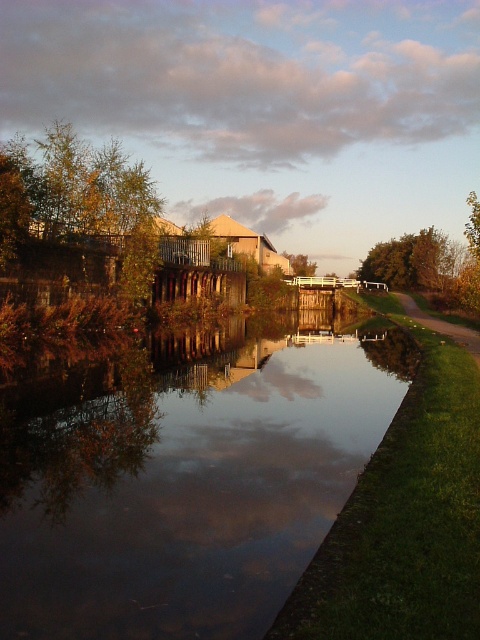
Who is more distant from viewer, [104,563] or [427,289]?

Point [427,289]

This screenshot has width=480, height=640. What are the coordinates of `smooth reflective water at center` in the screenshot? It's located at (183, 481).

Does smooth reflective water at center appear over green leafy tree at center?

Incorrect, smooth reflective water at center is not positioned above green leafy tree at center.

Is point (28, 486) in front of point (300, 269)?

Yes, it is in front of point (300, 269).

Locate an element on the screen. The height and width of the screenshot is (640, 480). smooth reflective water at center is located at coordinates (183, 481).

Is green leafy tree at right to the right of grassy dirt path at lower right from the viewer's perspective?

Yes, green leafy tree at right is to the right of grassy dirt path at lower right.

Who is more forward, (447, 272) or (409, 310)?

Point (409, 310) is in front.

Does point (372, 262) come behind point (462, 342)?

Yes.

Locate an element on the screen. This screenshot has height=640, width=480. green leafy tree at right is located at coordinates (412, 260).